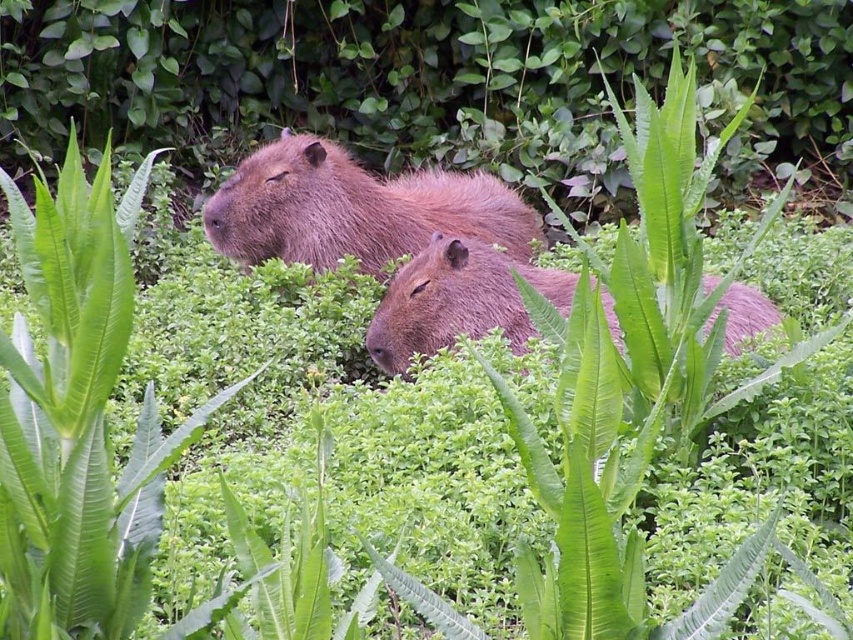
You are observing two capybaras in a green environment. You notice a brown furry capybara at center and a fuzzy brown capybara at center. Which one is positioned higher in the image?

The brown furry capybara at center is positioned higher than the fuzzy brown capybara at center.

You are a wildlife photographer trying to capture both capybaras in a single shot. Since your camera has a limited field of view, you need to position yourself so that both the brown furry capybara at center and the fuzzy brown capybara at center are visible. Based on their positions, which direction should you stand relative to the capybaras to ensure both are in frame?

You should stand to the right of the capybaras because the brown furry capybara at center is to the left of the fuzzy brown capybara at center. By positioning yourself to the right, you can capture both in your camera frame as they are aligned from left to right.